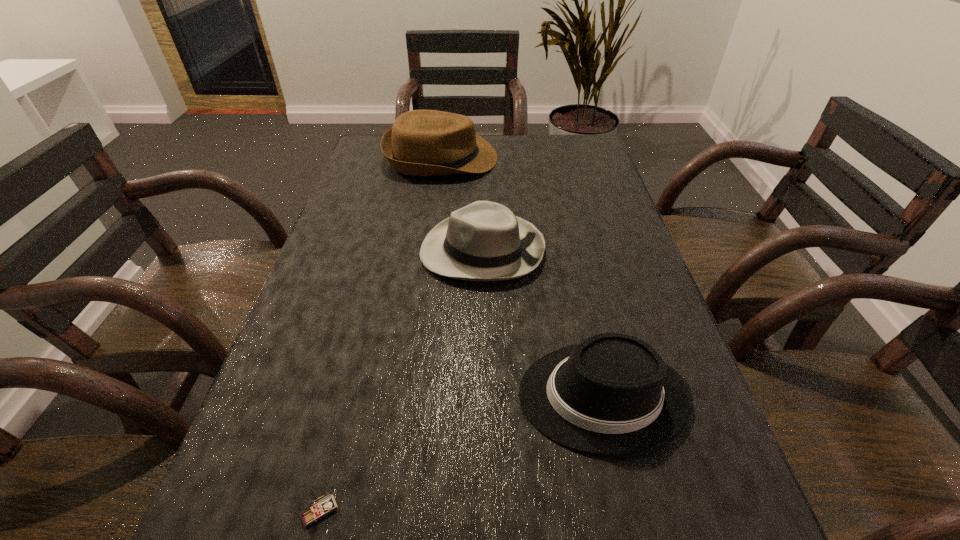
This screenshot has height=540, width=960. What are the coordinates of `vacant space that's between the nearest fedora and the farthest object` in the screenshot? It's located at (521, 277).

I want to click on object that is the third closest to the third nearest object, so click(x=325, y=506).

Point out which object is positioned as the nearest to the nearest object. Please provide its 2D coordinates. Your answer should be formatted as a tuple, i.e. [(x, y)], where the tuple contains the x and y coordinates of a point satisfying the conditions above.

[(612, 395)]

Select which fedora appears as the closest to the nearest object. Please provide its 2D coordinates. Your answer should be formatted as a tuple, i.e. [(x, y)], where the tuple contains the x and y coordinates of a point satisfying the conditions above.

[(612, 395)]

The width and height of the screenshot is (960, 540). In order to click on fedora that is the second nearest to the shortest object in this screenshot , I will do `click(484, 241)`.